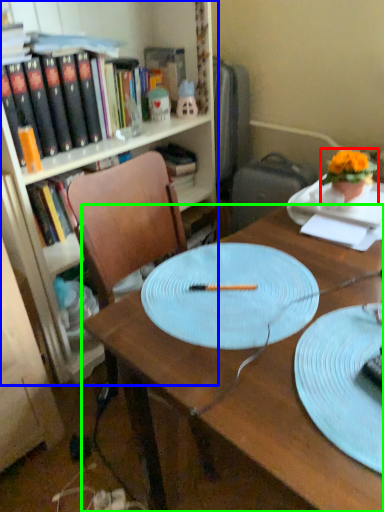
Question: Considering the real-world distances, which object is farthest from houseplant (highlighted by a red box)? bookcase (highlighted by a blue box) or desk (highlighted by a green box)?

Choices:
 (A) bookcase
 (B) desk

Answer: (A)